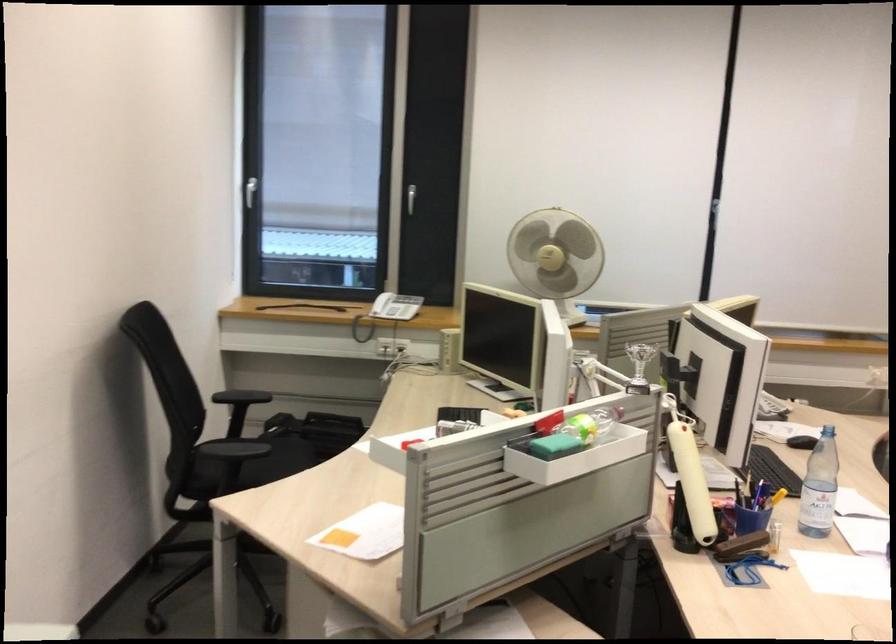
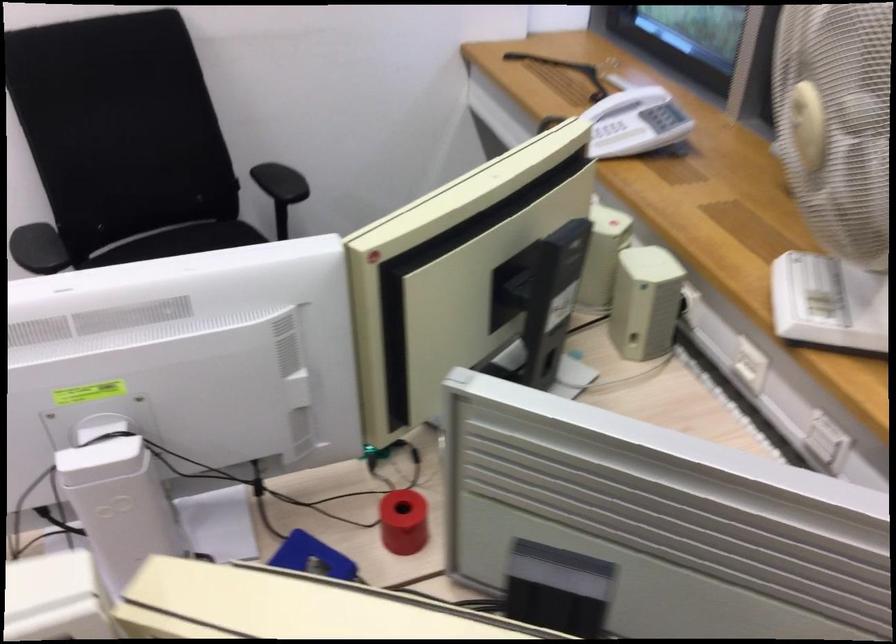
Find the pixel in the second image that matches the point at 382,303 in the first image.

(612, 131)